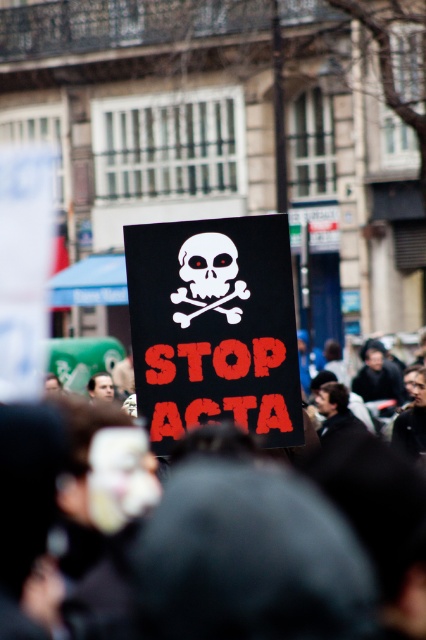
Question: Does black matte placard at center have a greater width compared to white matte skull at center?

Choices:
 (A) no
 (B) yes

Answer: (A)

Question: Is black fabric crowd at center to the right of white matte skull at center from the viewer's perspective?

Choices:
 (A) no
 (B) yes

Answer: (B)

Question: Among these points, which one is nearest to the camera?

Choices:
 (A) (282, 340)
 (B) (203, 621)

Answer: (B)

Question: Does black fabric crowd at center come behind white matte skull at center?

Choices:
 (A) no
 (B) yes

Answer: (A)

Question: Estimate the real-world distances between objects in this image. Which object is closer to the black matte placard at center?

Choices:
 (A) white matte skull at center
 (B) black fabric crowd at center

Answer: (A)

Question: Which point is closer to the camera?

Choices:
 (A) (203, 275)
 (B) (11, 440)

Answer: (B)